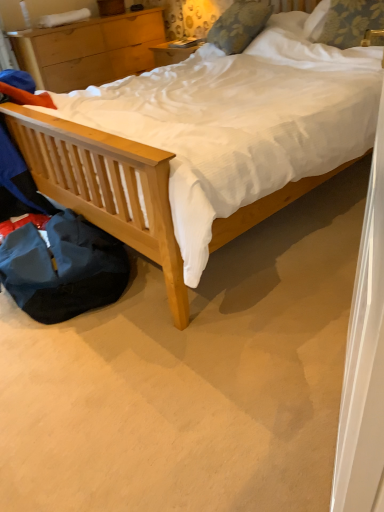
Question: Is light wood nightstand at upper left outside of floral fabric pillow at upper right, arranged as the 2th pillow when viewed from the left?

Choices:
 (A) no
 (B) yes

Answer: (B)

Question: Is light wood nightstand at upper left oriented away from floral fabric pillow at upper right, positioned as the first pillow in right-to-left order?

Choices:
 (A) no
 (B) yes

Answer: (A)

Question: From the image's perspective, is light wood nightstand at upper left under floral fabric pillow at upper right, positioned as the first pillow in right-to-left order?

Choices:
 (A) yes
 (B) no

Answer: (B)

Question: Is light wood nightstand at upper left smaller than floral fabric pillow at upper right, positioned as the first pillow in right-to-left order?

Choices:
 (A) no
 (B) yes

Answer: (A)

Question: Can floral fabric pillow at upper right, arranged as the 2th pillow when viewed from the left, be found inside light wood nightstand at upper left?

Choices:
 (A) no
 (B) yes

Answer: (A)

Question: From the image's perspective, is floral fabric pillow at upper right, arranged as the 2th pillow when viewed from the left, located above or below floral fabric pillow at upper center, the second pillow when ordered from right to left?

Choices:
 (A) below
 (B) above

Answer: (A)

Question: Choose the correct answer: Is floral fabric pillow at upper right, positioned as the first pillow in right-to-left order, inside floral fabric pillow at upper center, marked as the first pillow in a left-to-right arrangement, or outside it?

Choices:
 (A) inside
 (B) outside

Answer: (B)

Question: From a real-world perspective, is floral fabric pillow at upper right, arranged as the 2th pillow when viewed from the left, physically located above or below floral fabric pillow at upper center, the second pillow when ordered from right to left?

Choices:
 (A) below
 (B) above

Answer: (A)

Question: In terms of size, does floral fabric pillow at upper right, positioned as the first pillow in right-to-left order, appear bigger or smaller than floral fabric pillow at upper center, the second pillow when ordered from right to left?

Choices:
 (A) small
 (B) big

Answer: (A)

Question: From the image's perspective, is floral fabric pillow at upper center, marked as the first pillow in a left-to-right arrangement, positioned above or below floral fabric pillow at upper right, positioned as the first pillow in right-to-left order?

Choices:
 (A) above
 (B) below

Answer: (A)

Question: From a real-world perspective, is floral fabric pillow at upper center, marked as the first pillow in a left-to-right arrangement, physically located above or below floral fabric pillow at upper right, positioned as the first pillow in right-to-left order?

Choices:
 (A) above
 (B) below

Answer: (A)

Question: Visually, is floral fabric pillow at upper center, marked as the first pillow in a left-to-right arrangement, positioned to the left or to the right of floral fabric pillow at upper right, arranged as the 2th pillow when viewed from the left?

Choices:
 (A) right
 (B) left

Answer: (B)

Question: In terms of size, does floral fabric pillow at upper center, marked as the first pillow in a left-to-right arrangement, appear bigger or smaller than floral fabric pillow at upper right, positioned as the first pillow in right-to-left order?

Choices:
 (A) small
 (B) big

Answer: (B)

Question: Based on their sizes in the image, would you say light wood nightstand at upper left is bigger or smaller than floral fabric pillow at upper center, the second pillow when ordered from right to left?

Choices:
 (A) small
 (B) big

Answer: (B)

Question: Is point (36, 72) positioned closer to the camera than point (226, 12)?

Choices:
 (A) closer
 (B) farther

Answer: (B)